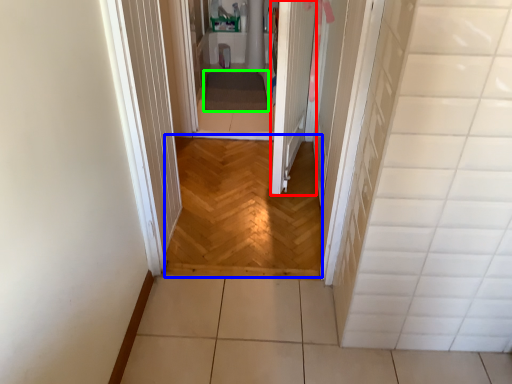
Question: Estimate the real-world distances between objects in this image. Which object is closer to door (highlighted by a red box), corridor (highlighted by a blue box) or blanket (highlighted by a green box)?

Choices:
 (A) corridor
 (B) blanket

Answer: (A)